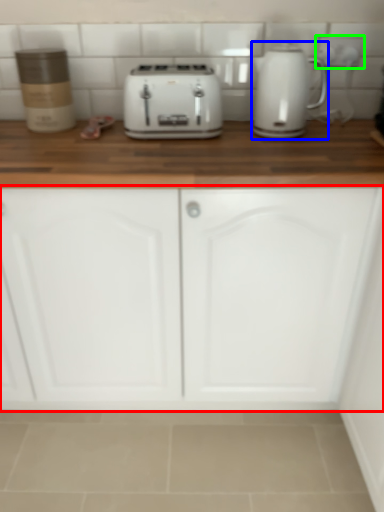
Question: Estimate the real-world distances between objects in this image. Which object is closer to cabinetry (highlighted by a red box), home appliance (highlighted by a blue box) or electric outlet (highlighted by a green box)?

Choices:
 (A) home appliance
 (B) electric outlet

Answer: (A)